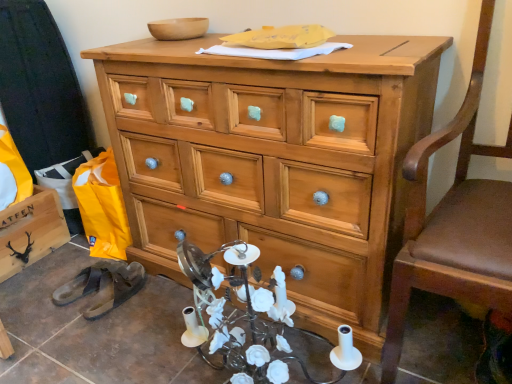
Question: Is natural wood chest of drawers at center far away from brown leather swivel chair at right?

Choices:
 (A) yes
 (B) no

Answer: (B)

Question: From a real-world perspective, is natural wood chest of drawers at center positioned over brown leather swivel chair at right based on gravity?

Choices:
 (A) yes
 (B) no

Answer: (B)

Question: Is natural wood chest of drawers at center smaller than brown leather swivel chair at right?

Choices:
 (A) no
 (B) yes

Answer: (A)

Question: Is natural wood chest of drawers at center completely or partially outside of brown leather swivel chair at right?

Choices:
 (A) no
 (B) yes

Answer: (B)

Question: Is natural wood chest of drawers at center at the right side of brown leather swivel chair at right?

Choices:
 (A) yes
 (B) no

Answer: (B)

Question: Looking at the image, does black rubber sandals at lower left seem bigger or smaller compared to brown leather swivel chair at right?

Choices:
 (A) big
 (B) small

Answer: (B)

Question: In the image, is black rubber sandals at lower left positioned in front of or behind brown leather swivel chair at right?

Choices:
 (A) behind
 (B) front

Answer: (A)

Question: From their relative heights in the image, would you say black rubber sandals at lower left is taller or shorter than brown leather swivel chair at right?

Choices:
 (A) short
 (B) tall

Answer: (A)

Question: From the image's perspective, is black rubber sandals at lower left located above or below brown leather swivel chair at right?

Choices:
 (A) below
 (B) above

Answer: (A)

Question: Considering the positions of brown leather swivel chair at right and black rubber sandals at lower left in the image, is brown leather swivel chair at right bigger or smaller than black rubber sandals at lower left?

Choices:
 (A) big
 (B) small

Answer: (A)

Question: From the image's perspective, is brown leather swivel chair at right above or below black rubber sandals at lower left?

Choices:
 (A) above
 (B) below

Answer: (A)

Question: Considering their positions, is brown leather swivel chair at right located in front of or behind black rubber sandals at lower left?

Choices:
 (A) behind
 (B) front

Answer: (B)

Question: From a real-world perspective, is brown leather swivel chair at right positioned above or below black rubber sandals at lower left?

Choices:
 (A) below
 (B) above

Answer: (B)

Question: From a real-world perspective, is black rubber sandals at lower left above or below black matte wooden cabinet at lower left?

Choices:
 (A) below
 (B) above

Answer: (A)

Question: Is black rubber sandals at lower left taller or shorter than black matte wooden cabinet at lower left?

Choices:
 (A) short
 (B) tall

Answer: (A)